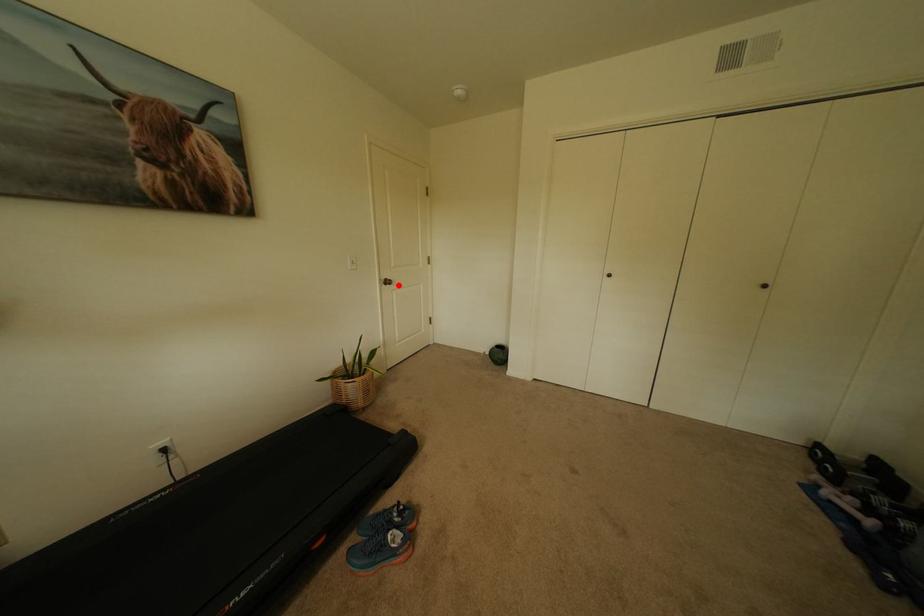
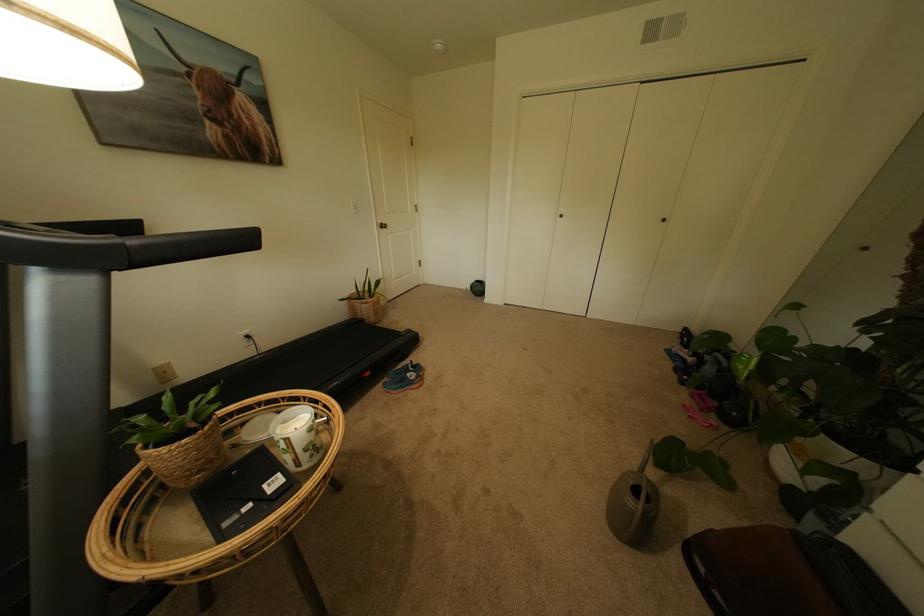
Locate, in the second image, the point that corresponds to the highlighted location in the first image.

(394, 229)